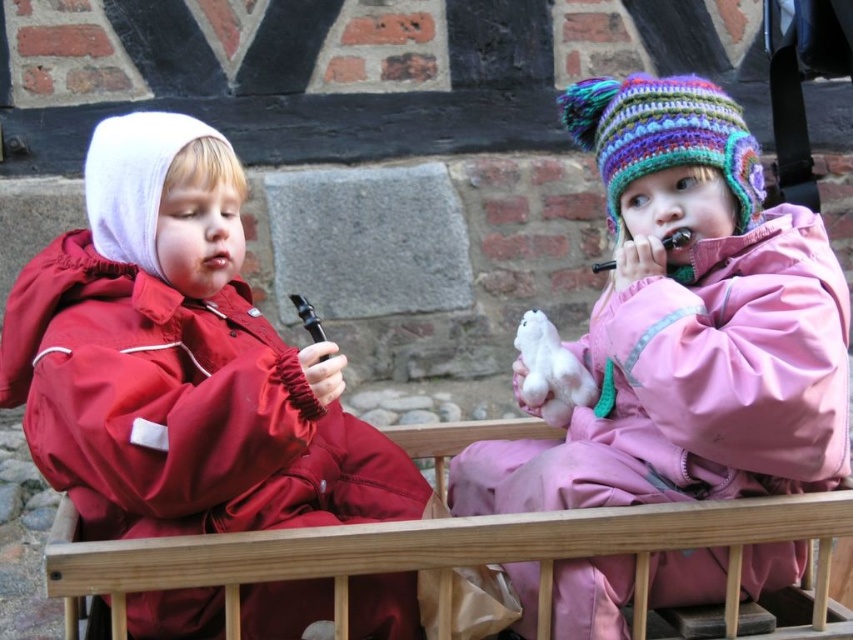
Is point (567, 371) positioned behind point (202, 257)?

Yes, it is.

Between white plush toy at center and matte pink lips at center, which one appears on the left side from the viewer's perspective?

matte pink lips at center is more to the left.

You are a GUI agent. You are given a task and a screenshot of the screen. Output one action in this format:
    pyautogui.click(x=<x>, y=<y>)
    Task: Click on the white plush toy at center
    The image size is (853, 640).
    Given the screenshot: What is the action you would take?
    pyautogui.click(x=550, y=371)

Does point (403, 561) come behind point (215, 252)?

No.

Does wooden bench at center have a lesser width compared to matte pink lips at center?

No, wooden bench at center is not thinner than matte pink lips at center.

Who is more distant from viewer, (735,500) or (202,264)?

Point (202,264)

Where is `wooden bench at center`? wooden bench at center is located at coordinates (450, 554).

Is pink matte snowsuit at center shorter than wooden bench at center?

No.

Does point (657, 163) lie in front of point (395, 563)?

No, it is not.

Locate an element on the screen. This screenshot has height=640, width=853. pink matte snowsuit at center is located at coordinates (688, 324).